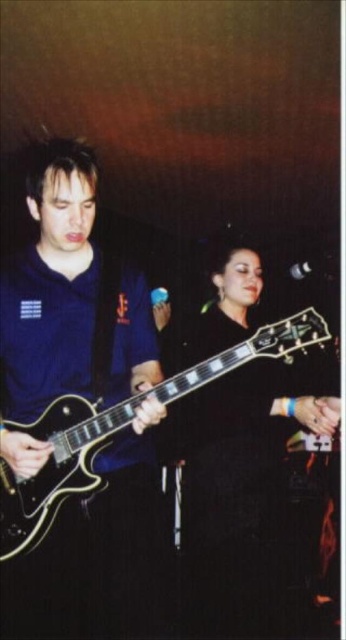
Question: Considering the real-world distances, which object is closest to the matte black guitar at left?

Choices:
 (A) shiny black guitar at center
 (B) black glossy electric guitar at center

Answer: (B)

Question: Can you confirm if shiny black guitar at center is smaller than black glossy electric guitar at center?

Choices:
 (A) yes
 (B) no

Answer: (B)

Question: Does matte black guitar at left appear over shiny black guitar at center?

Choices:
 (A) yes
 (B) no

Answer: (A)

Question: Which object is the farthest from the matte black guitar at left?

Choices:
 (A) black glossy electric guitar at center
 (B) shiny black guitar at center

Answer: (B)

Question: Which of these objects is positioned farthest from the shiny black guitar at center?

Choices:
 (A) matte black guitar at left
 (B) black glossy electric guitar at center

Answer: (B)

Question: Can you confirm if matte black guitar at left is thinner than black glossy electric guitar at center?

Choices:
 (A) no
 (B) yes

Answer: (B)